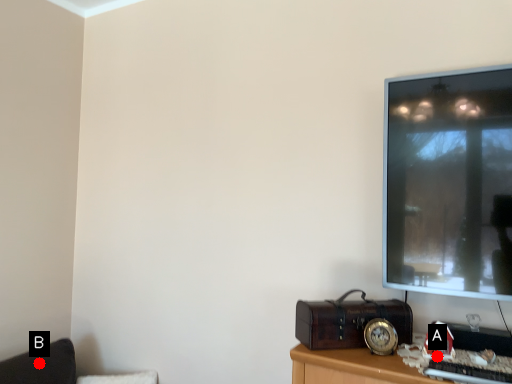
Question: Two points are circled on the image, labeled by A and B beside each circle. Which point appears farthest from the camera in this image?

Choices:
 (A) A is further
 (B) B is further

Answer: (B)